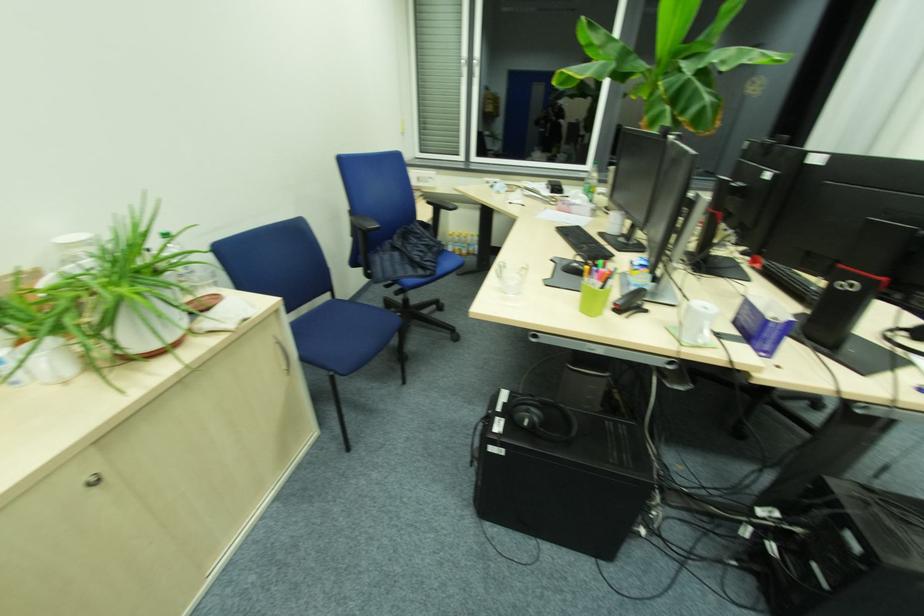
Where is `blue chair sitting surface`? blue chair sitting surface is located at coordinates (346, 329).